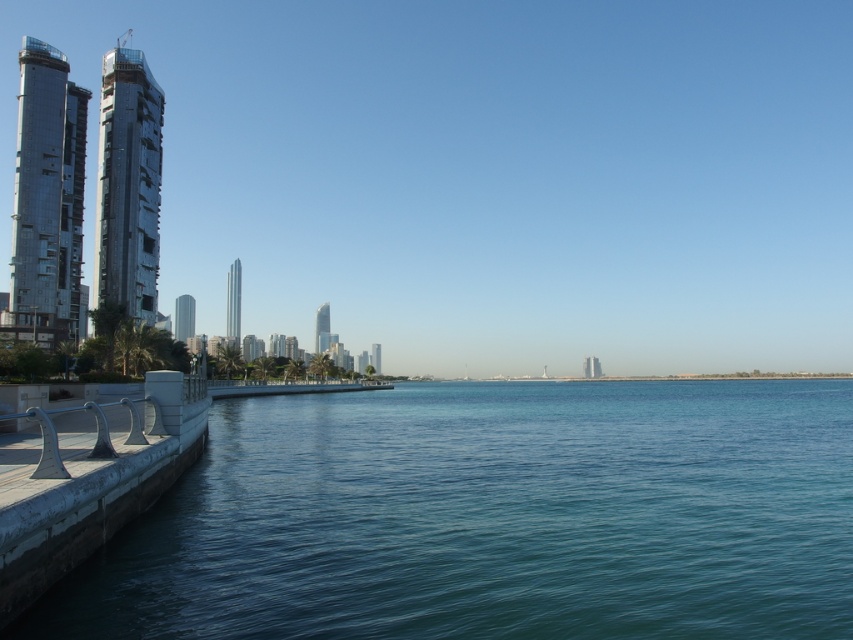
Does clear blue water at lower left have a larger size compared to white concrete dock at lower left?

Correct, clear blue water at lower left is larger in size than white concrete dock at lower left.

Is clear blue water at lower left below white concrete dock at lower left?

Yes, clear blue water at lower left is below white concrete dock at lower left.

Between point (718, 513) and point (33, 506), which one is positioned behind?

Positioned behind is point (718, 513).

Where is `clear blue water at lower left`? clear blue water at lower left is located at coordinates (492, 516).